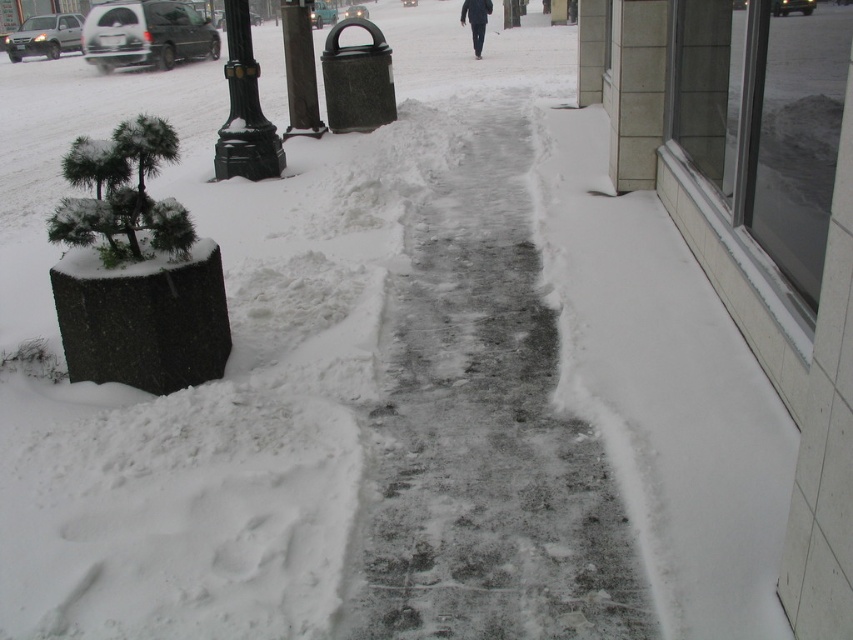
Does black cast iron pole at center appear over sanded concrete pole at center?

No, black cast iron pole at center is not above sanded concrete pole at center.

Between black cast iron pole at center and sanded concrete pole at center, which one appears on the left side from the viewer's perspective?

black cast iron pole at center is more to the left.

Is point (223, 16) positioned before point (308, 88)?

That is False.

Find the location of a particular element. The width and height of the screenshot is (853, 640). black cast iron pole at center is located at coordinates coord(244,108).

Who is taller, icey concrete path at center or black matte pants at center?

With more height is black matte pants at center.

Is icey concrete path at center wider than black matte pants at center?

Yes, icey concrete path at center is wider than black matte pants at center.

Which is behind, point (405, 564) or point (473, 1)?

Positioned behind is point (473, 1).

Find the location of a particular element. icey concrete path at center is located at coordinates (485, 435).

Is black cast iron pole at center taller than black matte pants at center?

Yes, black cast iron pole at center is taller than black matte pants at center.

The image size is (853, 640). What do you see at coordinates (244, 108) in the screenshot?
I see `black cast iron pole at center` at bounding box center [244, 108].

Locate an element on the screen. The image size is (853, 640). black cast iron pole at center is located at coordinates (244, 108).